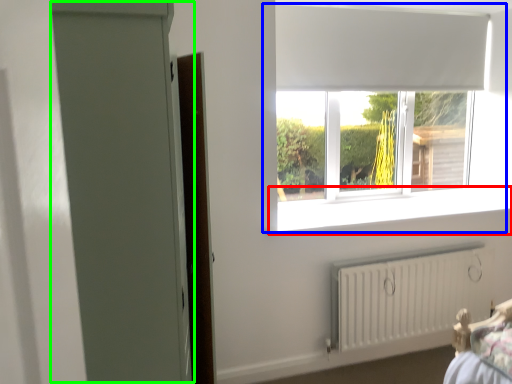
Question: Considering the real-world distances, which object is farthest from window sill (highlighted by a red box)? window (highlighted by a blue box) or screen door (highlighted by a green box)?

Choices:
 (A) window
 (B) screen door

Answer: (B)